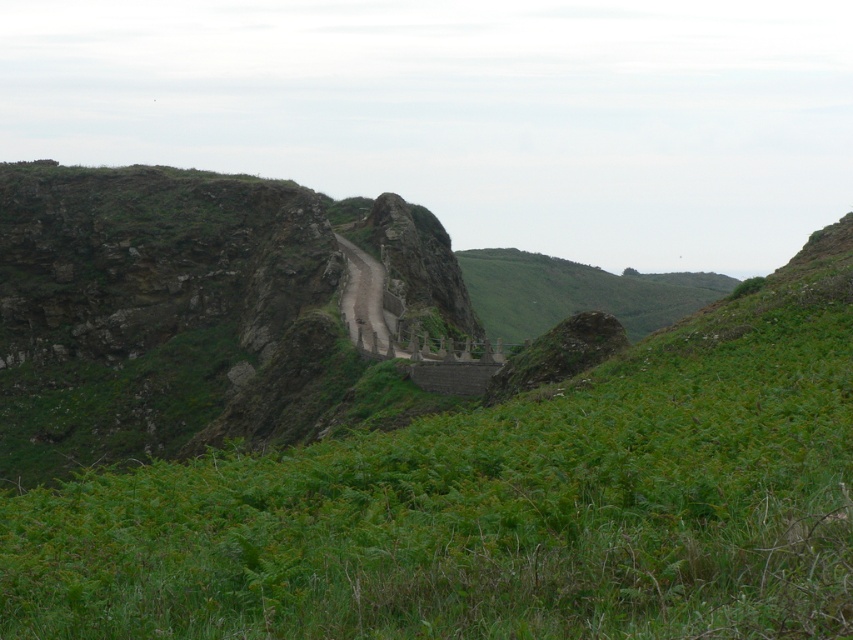
You are standing at the base of the winding stone staircase and want to place a small decorative rock exactly where the green leafy grass at center is located. According to the image, what are the coordinates of the spot where you should place the rock?

The coordinates for the green leafy grass at center are at point [498,504], so you should place the rock there.

You are a hiker trying to navigate through the rocky terrain. You notice green leafy grass at center and dull gray stone at center. Which object would you choose to step on for a more stable footing, and why?

The green leafy grass at center is bigger than the dull gray stone at center, so stepping on the dull gray stone at center would provide a more stable footing because it has a larger surface area compared to the smaller grass.